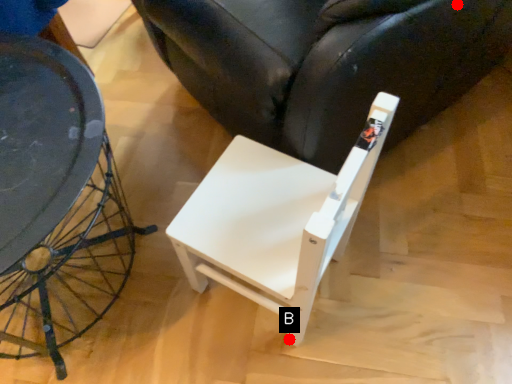
Question: Two points are circled on the image, labeled by A and B beside each circle. Which of the following is the farthest from the observer?

Choices:
 (A) A is further
 (B) B is further

Answer: (B)